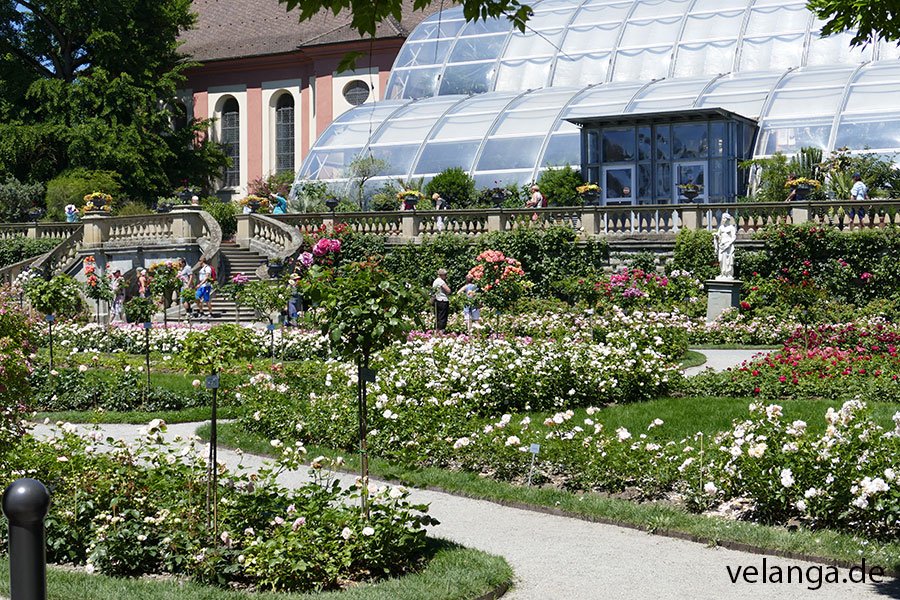
At what (x,y) coordinates should I click in order to perform the action: click on floor. Please return your answer as a coordinate pair (x, y). Looking at the image, I should click on (552, 550), (707, 366), (230, 320).